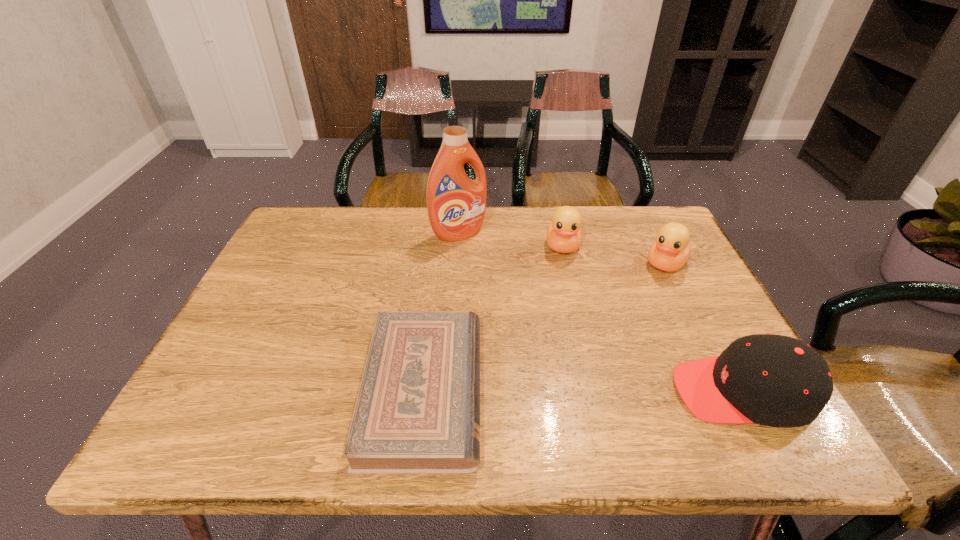
Locate an element on the screen. The height and width of the screenshot is (540, 960). the shortest object is located at coordinates tap(417, 410).

Locate an element on the screen. cap is located at coordinates (775, 380).

This screenshot has height=540, width=960. What are the coordinates of `the left duckling` in the screenshot? It's located at (564, 234).

Locate an element on the screen. the right duckling is located at coordinates (669, 252).

At what (x,y) coordinates should I click in order to perform the action: click on the tallest object. Please return your answer as a coordinate pair (x, y). Looking at the image, I should click on pyautogui.click(x=456, y=205).

Find the location of `free location located 0.090m on the spine side of the Bible`. free location located 0.090m on the spine side of the Bible is located at coordinates click(524, 390).

Image resolution: width=960 pixels, height=540 pixels. In order to click on vacant region located on the front-facing side of the cap in this screenshot , I will do `click(517, 392)`.

Find the location of a particular element. blank area located on the front-facing side of the cap is located at coordinates (517, 392).

Where is `vacant area situated on the front-facing side of the cap`? This screenshot has width=960, height=540. vacant area situated on the front-facing side of the cap is located at coordinates (508, 392).

The height and width of the screenshot is (540, 960). What are the coordinates of `free spot located 0.070m on the face of the left duckling` in the screenshot? It's located at (564, 278).